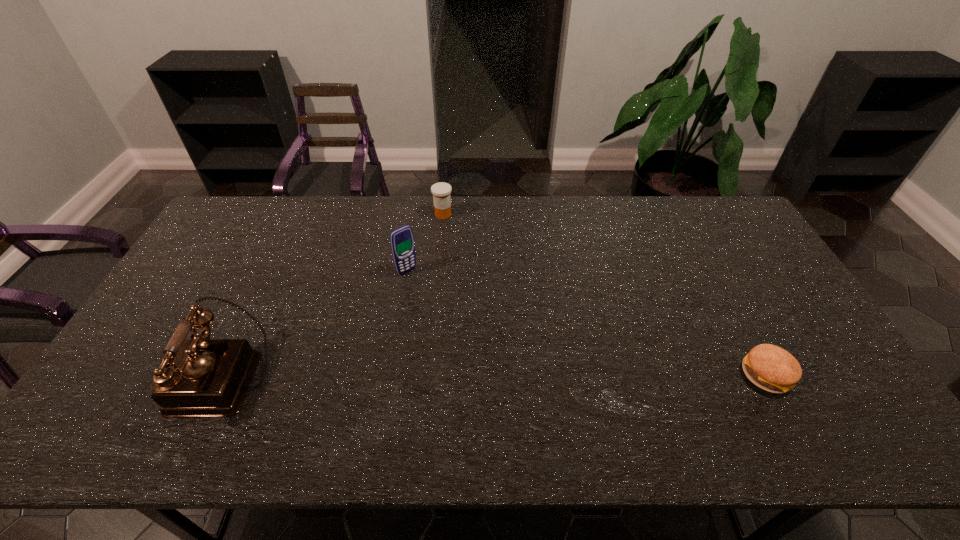
The image size is (960, 540). Find the location of `empty location between the third tallest object and the telephone`. empty location between the third tallest object and the telephone is located at coordinates (332, 295).

In order to click on free space that is in between the third nearest object and the medicine in this screenshot , I will do pos(425,242).

This screenshot has height=540, width=960. Identify the location of free area in between the medicine and the shortest object. (605, 295).

The width and height of the screenshot is (960, 540). I want to click on vacant area between the second object from left to right and the leftmost object, so click(x=314, y=324).

Locate an element on the screen. unoccupied position between the farthest object and the tallest object is located at coordinates (332, 295).

Identify the location of empty location between the telephone and the farthest object. Image resolution: width=960 pixels, height=540 pixels. (332, 295).

Where is `vacant area between the leftmost object and the second tallest object`? vacant area between the leftmost object and the second tallest object is located at coordinates (314, 324).

The image size is (960, 540). What are the coordinates of `vacant space in between the rightmost object and the telephone` in the screenshot? It's located at (494, 376).

In order to click on free space between the second tallest object and the shortest object in this screenshot , I will do `click(587, 323)`.

Identify the location of free spot between the leftmost object and the rightmost object. (494, 376).